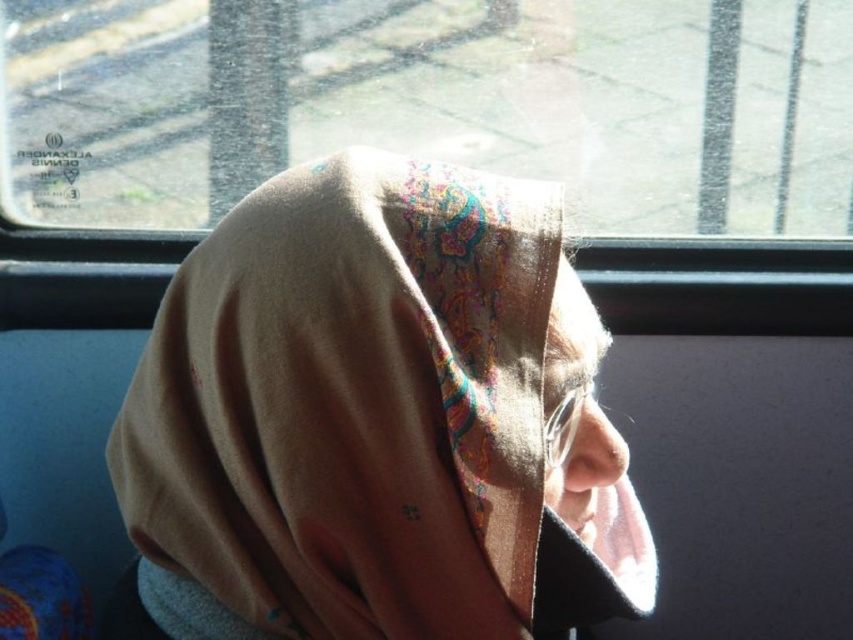
Question: Is beige fabric headscarf at center to the right of transparent glass at upper center from the viewer's perspective?

Choices:
 (A) no
 (B) yes

Answer: (B)

Question: Which point is farther from the camera taking this photo?

Choices:
 (A) (281, 348)
 (B) (776, 93)

Answer: (B)

Question: Is beige fabric headscarf at center positioned before transparent glass at upper center?

Choices:
 (A) yes
 (B) no

Answer: (A)

Question: Does beige fabric headscarf at center have a lesser width compared to transparent glass at upper center?

Choices:
 (A) yes
 (B) no

Answer: (A)